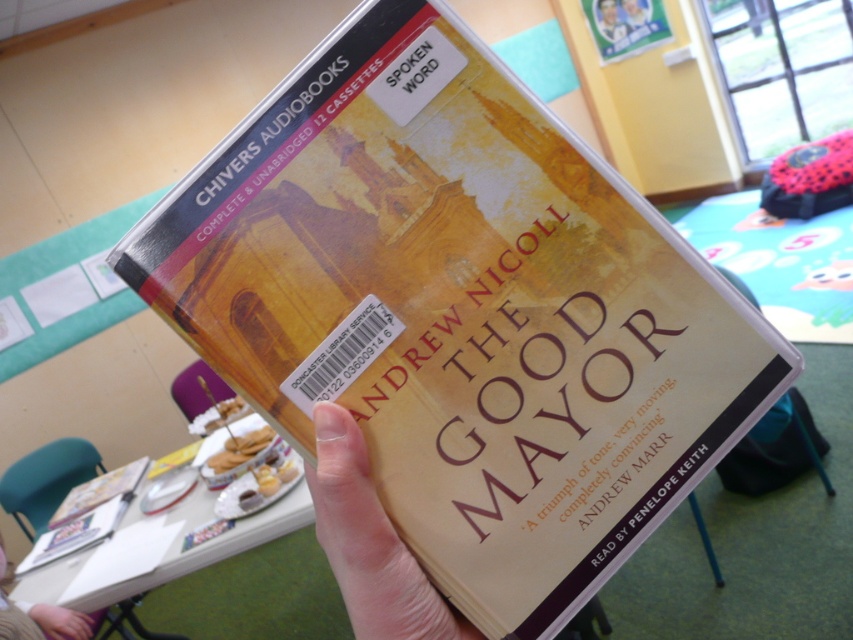
Question: Estimate the real-world distances between objects in this image. Which object is farther from the hardcover book at center?

Choices:
 (A) smooth skin hand at lower center
 (B) smooth beige hand at center

Answer: (B)

Question: Is smooth beige hand at center smaller than smooth skin hand at lower center?

Choices:
 (A) no
 (B) yes

Answer: (B)

Question: Which object appears closest to the camera in this image?

Choices:
 (A) hardcover book at center
 (B) smooth skin hand at lower center

Answer: (B)

Question: Which object is farther from the camera taking this photo?

Choices:
 (A) smooth skin hand at lower center
 (B) smooth beige hand at center
 (C) hardcover book at center

Answer: (C)

Question: Is smooth skin hand at lower center to the left of hardcover book at center from the viewer's perspective?

Choices:
 (A) yes
 (B) no

Answer: (B)

Question: Considering the relative positions of smooth skin hand at lower center and hardcover book at center in the image provided, where is smooth skin hand at lower center located with respect to hardcover book at center?

Choices:
 (A) above
 (B) below

Answer: (B)